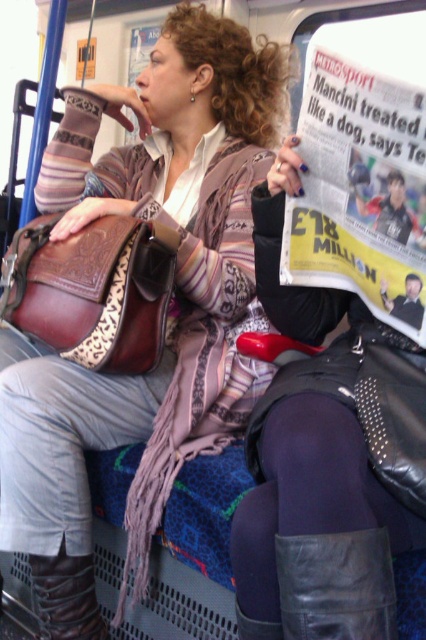
You are standing 1.5 meters away from the camera. Can you reach the point at coordinates point (189, 40) without moving closer?

The distance of point (189, 40) from camera is 1.47 meters, so yes, you can reach the point at coordinates point (189, 40) without moving closer since you are standing 1.5 meters away from the camera.

You are a passenger on the bus and need to retrieve your leather bag at center. To reach it, you must step over an obstacle. Is the leather boot at lower left positioned in a way that you would need to step over it to access your bag?

The leather bag at center is located above the leather boot at lower left, so you would not need to step over the boot to reach the bag since it is positioned above it.

You are a passenger on a bus and you see a leather bag at center and a leather boot at lower center. Which item takes up more space?

The leather bag at center is larger in size than the leather boot at lower center, so it takes up more space.